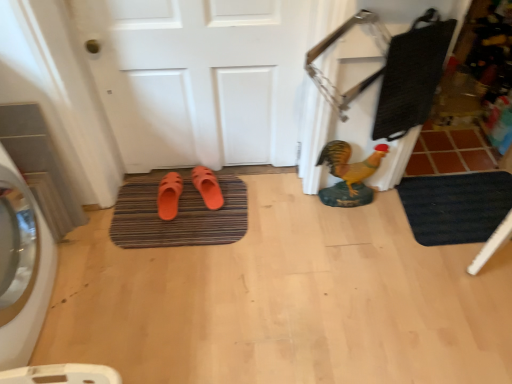
Identify the location of free space in front of black rubber bath mat at lower right, which is counted as the second bath mat, starting from the left. This screenshot has width=512, height=384. (458, 291).